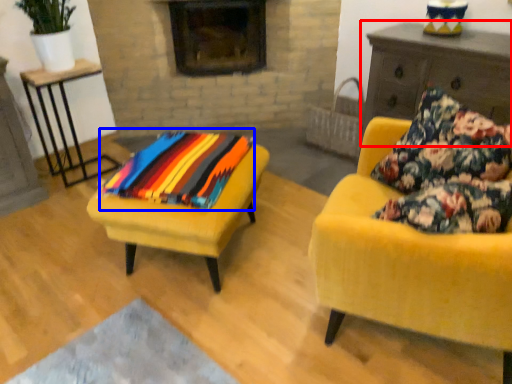
Question: Which object is closer to the camera taking this photo, dresser (highlighted by a red box) or blanket (highlighted by a blue box)?

Choices:
 (A) dresser
 (B) blanket

Answer: (B)